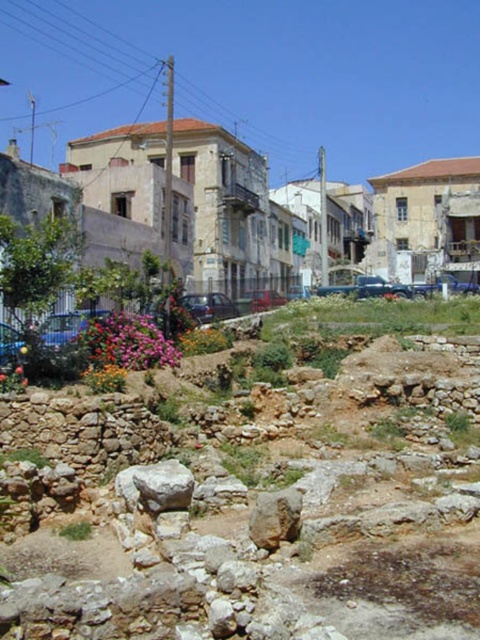
Question: Can you confirm if brown rough stone at lower center is bigger than brown rough rock at center?

Choices:
 (A) no
 (B) yes

Answer: (B)

Question: Is brown rough stone at lower center further to the viewer compared to brown rough rock at center?

Choices:
 (A) yes
 (B) no

Answer: (B)

Question: Is the position of brown rough stone at lower center less distant than that of brown rough rock at center?

Choices:
 (A) yes
 (B) no

Answer: (A)

Question: Which object is closer to the camera taking this photo?

Choices:
 (A) brown rough stone at lower center
 (B) brown rough rock at center

Answer: (A)